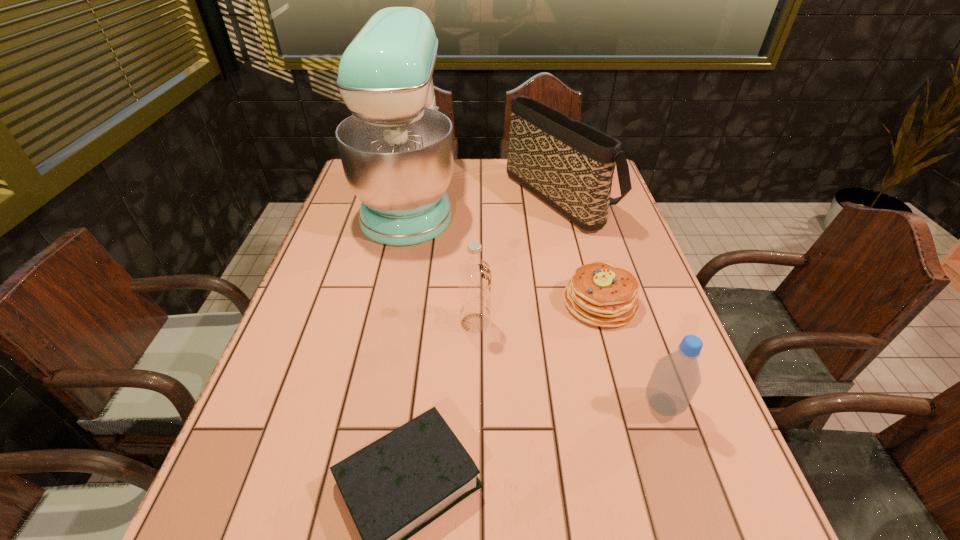
Find the location of a particular element. object that is the fourth closest to the handbag is located at coordinates (676, 377).

The height and width of the screenshot is (540, 960). Identify the location of free spot that satisfies the following two spatial constraints: 1. at the base of the mixer; 2. on the left side of the fourth tallest object. (366, 405).

Where is `free space that satisfies the following two spatial constraints: 1. on the back side of the bottle; 2. at the base of the mixer`? free space that satisfies the following two spatial constraints: 1. on the back side of the bottle; 2. at the base of the mixer is located at coordinates (591, 200).

I want to click on vacant area in the image that satisfies the following two spatial constraints: 1. at the base of the tallest object; 2. on the left side of the fifth tallest object, so click(388, 302).

At what (x,y) coordinates should I click in order to perform the action: click on vacant space that satisfies the following two spatial constraints: 1. at the base of the mixer; 2. on the back side of the second shortest object. Please return your answer as a coordinate pair (x, y). Looking at the image, I should click on (388, 302).